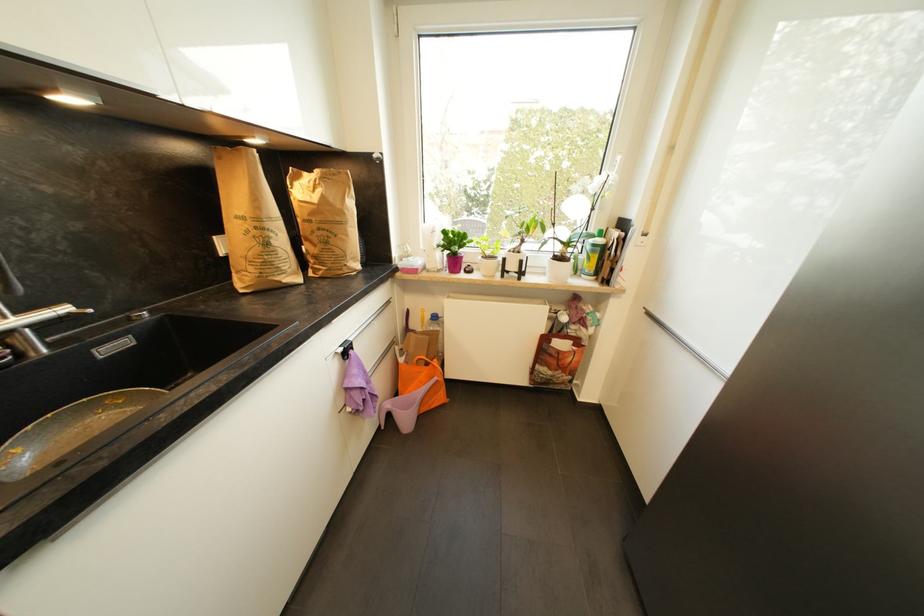
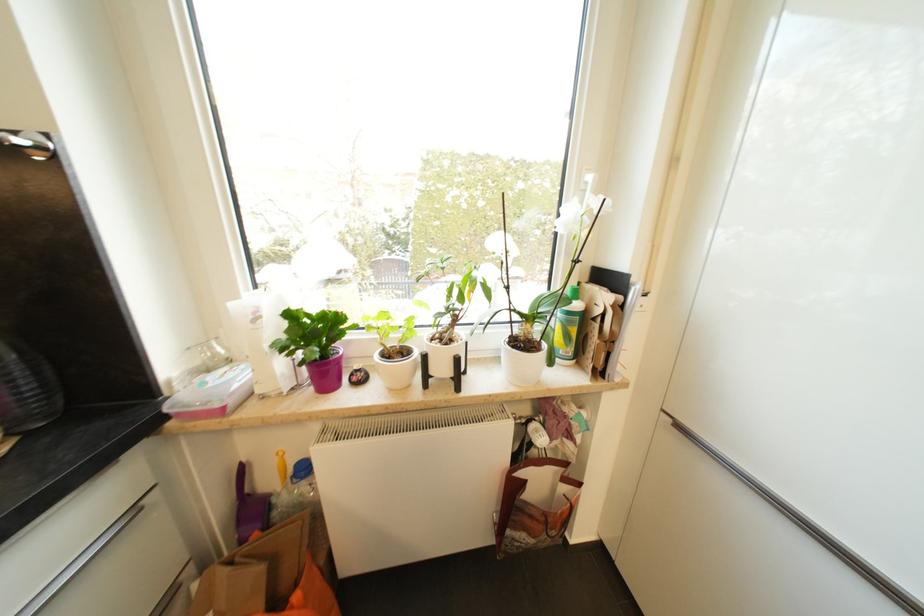
Where in the second image is the point corresponding to (x=450, y=233) from the first image?

(295, 317)